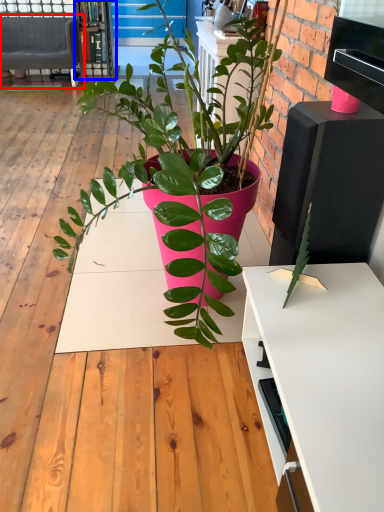
Question: Which object appears farthest to the camera in this image, studio couch (highlighted by a red box) or bookshelf (highlighted by a blue box)?

Choices:
 (A) studio couch
 (B) bookshelf

Answer: (B)